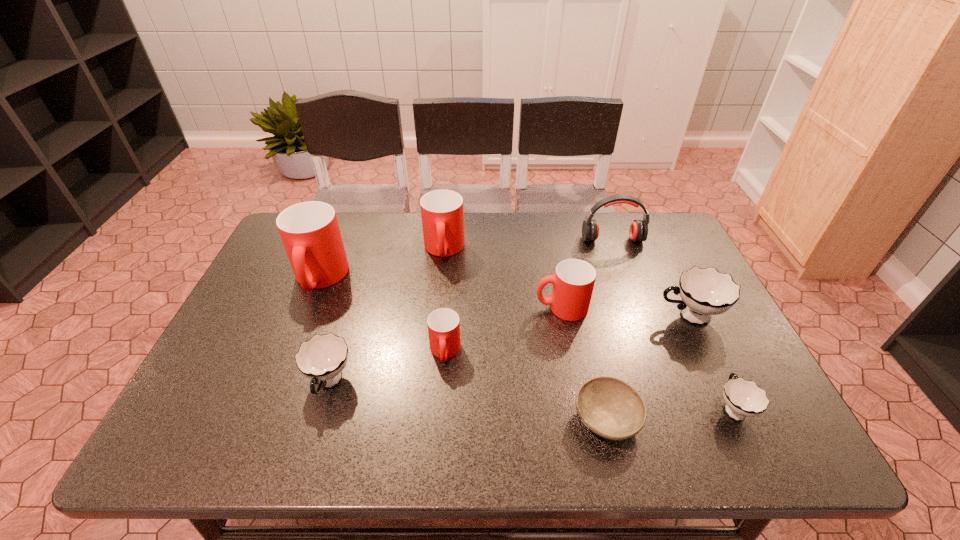
Identify the location of the shortest cup. This screenshot has height=540, width=960. (743, 398).

Where is `bowl`? Image resolution: width=960 pixels, height=540 pixels. bowl is located at coordinates (609, 407).

Locate an element on the screen. The height and width of the screenshot is (540, 960). the shortest object is located at coordinates (609, 407).

Locate an element on the screen. Image resolution: width=960 pixels, height=540 pixels. free space located 0.110m on the side of the tallest object with the handle is located at coordinates (297, 336).

Locate an element on the screen. This screenshot has width=960, height=540. free space located 0.100m on the side of the third smallest red cup with the handle is located at coordinates (440, 292).

At what (x,y) coordinates should I click in order to perform the action: click on blank space located 0.360m on the ear cups of the earphone. Please return your answer as a coordinate pair (x, y). The width and height of the screenshot is (960, 540). Looking at the image, I should click on (646, 332).

Locate an element on the screen. This screenshot has height=540, width=960. vacant space located on the side of the second smallest red cup with the handle is located at coordinates coord(432,308).

You are a GUI agent. You are given a task and a screenshot of the screen. Output one action in this format:
    pyautogui.click(x=<x>, y=<y>)
    Task: Click on the free space located 0.080m on the side of the second smallest red cup with the handle
    This screenshot has height=540, width=960.
    Given the screenshot: What is the action you would take?
    pyautogui.click(x=506, y=308)

At what (x,y) coordinates should I click in order to perform the action: click on vacant area situated 0.230m on the side of the second smallest red cup with the handle. Please return your answer as a coordinate pair (x, y). This screenshot has width=960, height=540. Looking at the image, I should click on (450, 308).

Find the location of `vacant space located on the side of the farthest white cup with the handle`. vacant space located on the side of the farthest white cup with the handle is located at coordinates (542, 316).